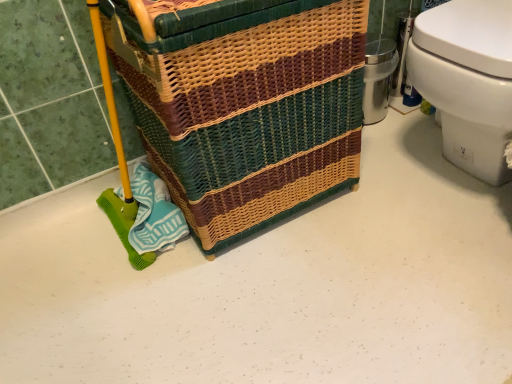
You are a GUI agent. You are given a task and a screenshot of the screen. Output one action in this format:
    pyautogui.click(x=<x>, y=<y>)
    Task: Click on the vacant region to the left of white glossy toilet at right
    
    Given the screenshot: What is the action you would take?
    pyautogui.click(x=376, y=208)